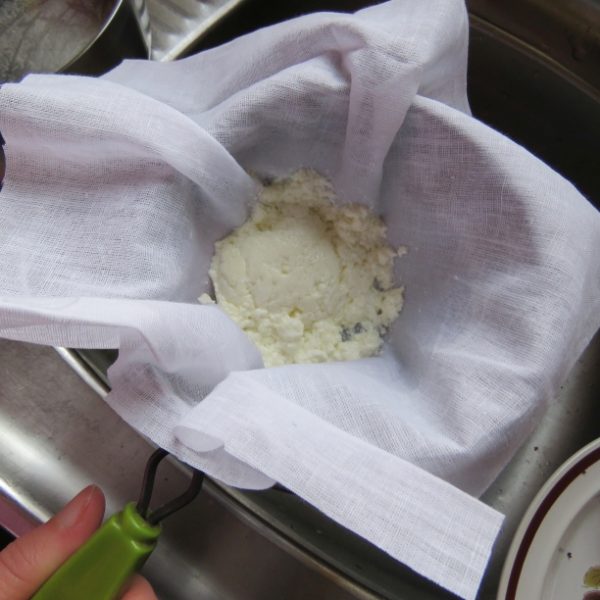
At what (x,y) coordinates should I click in order to perform the action: click on edge of white tray. Please return your answer as a coordinate pair (x, y). Looking at the image, I should click on (184, 21).